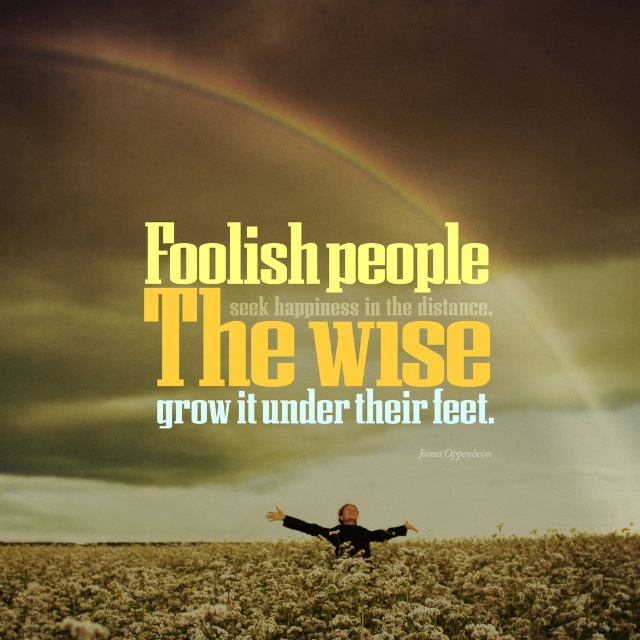
I want to click on smooth black arm at center, so click(388, 532).

Does smooth black arm at center have a smaller size compared to black matte arm at lower center?

Actually, smooth black arm at center might be larger than black matte arm at lower center.

Find the location of a particular element. The width and height of the screenshot is (640, 640). smooth black arm at center is located at coordinates (388, 532).

Where is `smooth black arm at center`? The width and height of the screenshot is (640, 640). smooth black arm at center is located at coordinates (388, 532).

Is white fluffy flowers at lower center behind black matte arm at lower center?

That is False.

Who is positioned more to the right, white fluffy flowers at lower center or black matte arm at lower center?

white fluffy flowers at lower center

Does point (145, 552) lie in front of point (284, 516)?

No.

Identify the location of white fluffy flowers at lower center. The image size is (640, 640). (326, 588).

Who is positioned more to the left, white fluffy flowers at lower center or smooth black arm at center?

From the viewer's perspective, white fluffy flowers at lower center appears more on the left side.

From the picture: Does white fluffy flowers at lower center have a larger size compared to smooth black arm at center?

Correct, white fluffy flowers at lower center is larger in size than smooth black arm at center.

Is point (499, 636) farther from viewer compared to point (369, 534)?

No, (499, 636) is closer to viewer.

This screenshot has height=640, width=640. I want to click on white fluffy flowers at lower center, so click(x=326, y=588).